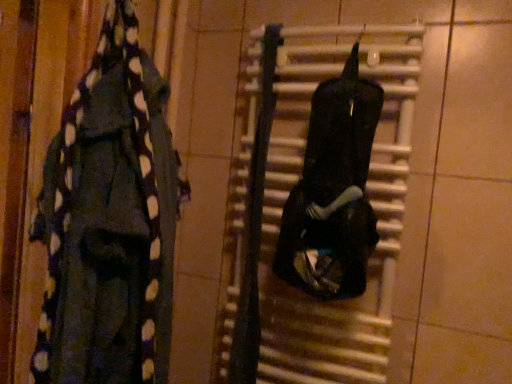
Question: Would you say black matte radiator at center is to the left or to the right of black polka dot scarf at left, which ranks as the 2th clothing in right-to-left order, in the picture?

Choices:
 (A) left
 (B) right

Answer: (B)

Question: Is point (395, 56) closer or farther from the camera than point (136, 322)?

Choices:
 (A) closer
 (B) farther

Answer: (B)

Question: Considering the real-world distances, which object is closest to the black matte backpack at center, the 1th clothing viewed from the right?

Choices:
 (A) black matte radiator at center
 (B) black polka dot scarf at left, positioned as the first clothing in left-to-right order

Answer: (A)

Question: Considering the real-world distances, which object is farthest from the black polka dot scarf at left, positioned as the first clothing in left-to-right order?

Choices:
 (A) black matte backpack at center, the 1th clothing viewed from the right
 (B) black matte radiator at center

Answer: (A)